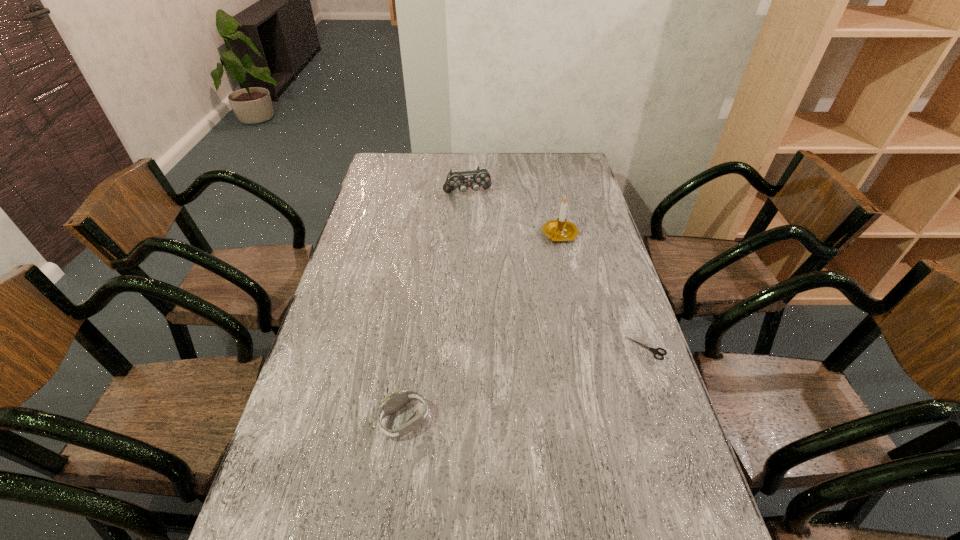
Identify the location of the nearest object. (397, 399).

Locate an element on the screen. the second shortest object is located at coordinates (397, 399).

I want to click on the rightmost object, so click(655, 350).

Where is `the shortest object`? the shortest object is located at coordinates (655, 350).

Locate an element on the screen. candle holder is located at coordinates (556, 230).

Locate an element on the screen. The image size is (960, 540). the third nearest object is located at coordinates pyautogui.click(x=556, y=230).

The height and width of the screenshot is (540, 960). I want to click on the third shortest object, so click(x=475, y=179).

Locate an element on the screen. Image resolution: width=960 pixels, height=540 pixels. control is located at coordinates (475, 179).

Find the location of a particular element. free point located on the face of the watch is located at coordinates (340, 421).

I want to click on vacant region located on the face of the watch, so click(302, 421).